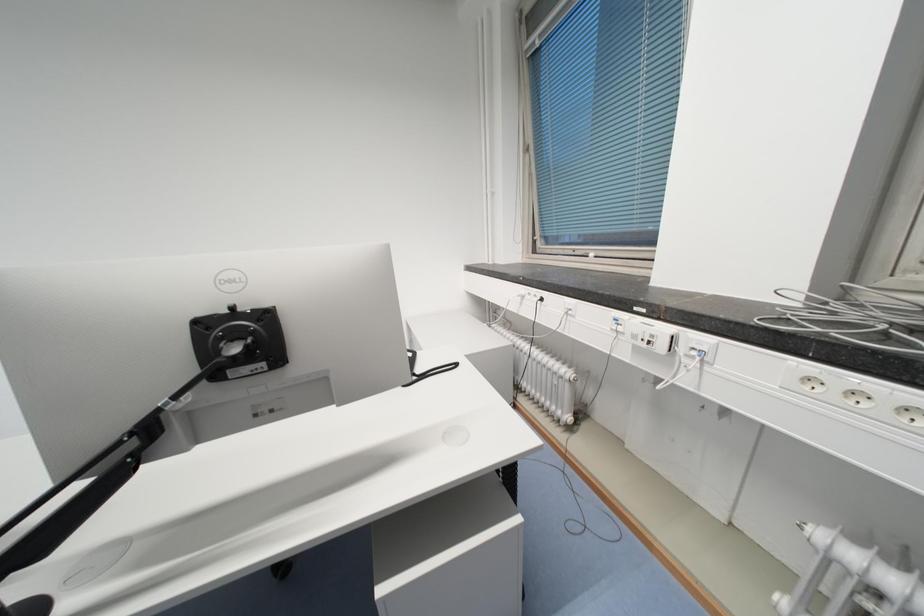
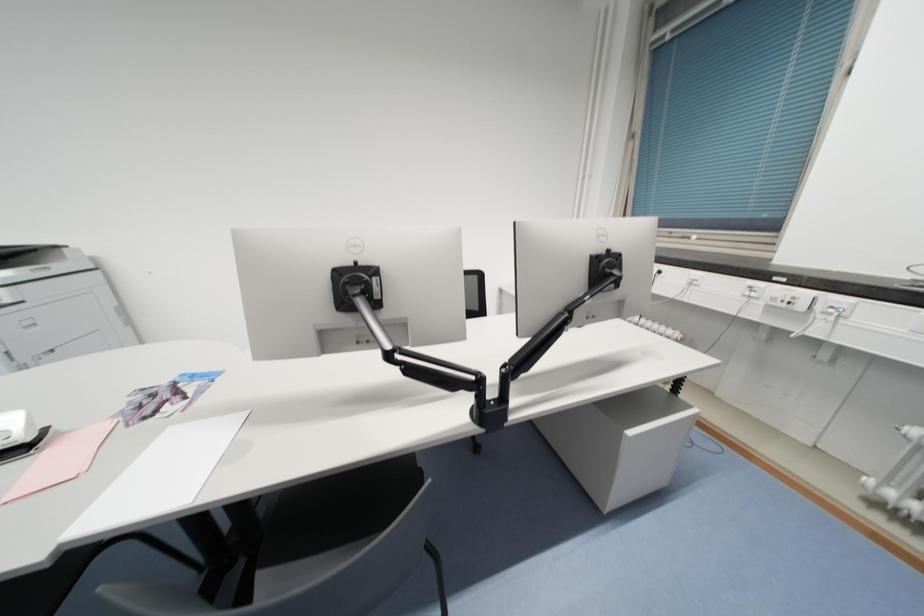
What movement of the cameraman would produce the second image?

The cameraman walked toward left, backward.